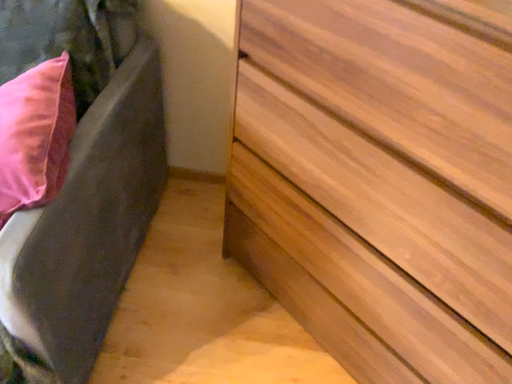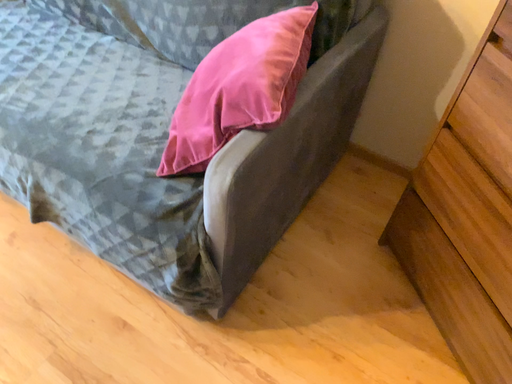
Question: How did the camera likely rotate when shooting the video?

Choices:
 (A) rotated left
 (B) rotated right

Answer: (A)